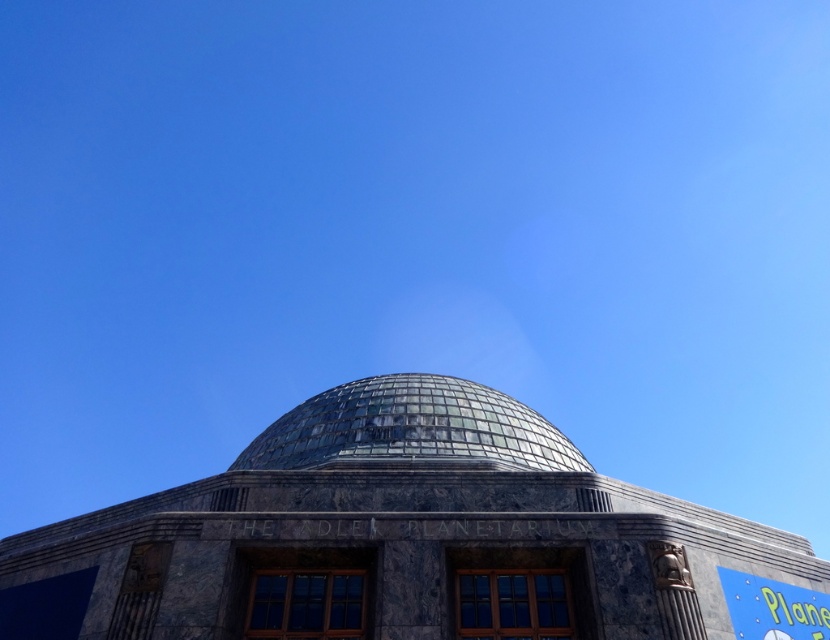
Based on the photo, you are a visitor standing in front of the building. You notice the transparent glass dome at center and the blue painted sign at lower right. Which object would appear bigger to you?

The transparent glass dome at center is larger in size than the blue painted sign at lower right, so it would appear bigger to you.

You are an architect analyzing the building facade. You need to determine which object occupies more horizontal space. Based on the scene, which object has a greater width between the transparent glass dome at center and the blue painted sign at lower right?

The transparent glass dome at center has a greater width than the blue painted sign at lower right.